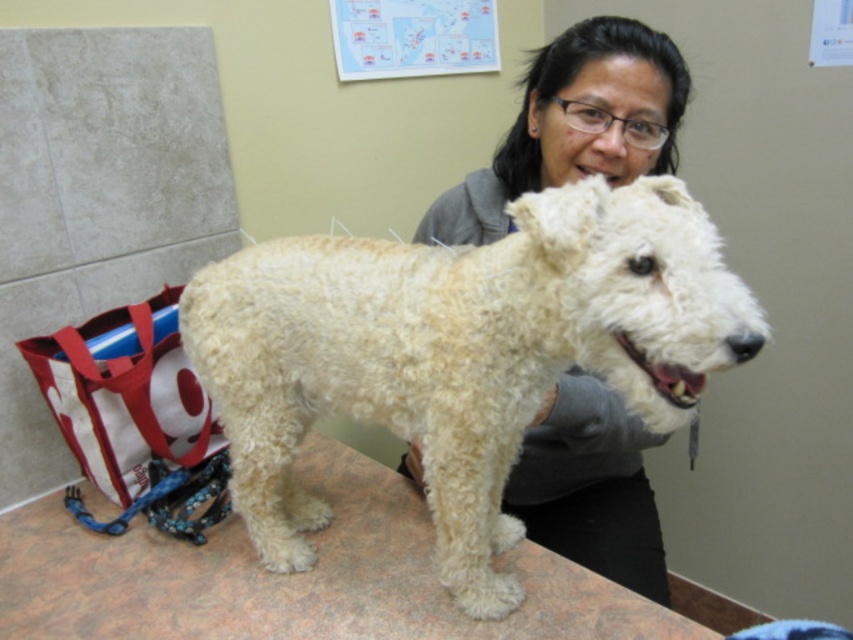
Question: Considering the real-world distances, which object is farthest from the smooth brown table at center?

Choices:
 (A) smooth gray hoodie at center
 (B) white fluffy dog at center

Answer: (A)

Question: Which point is closer to the camera taking this photo?

Choices:
 (A) (640, 554)
 (B) (440, 497)

Answer: (B)

Question: Is white fluffy dog at center positioned at the back of smooth brown table at center?

Choices:
 (A) yes
 (B) no

Answer: (B)

Question: Is white fluffy dog at center in front of smooth gray hoodie at center?

Choices:
 (A) yes
 (B) no

Answer: (A)

Question: Which point is closer to the camera?

Choices:
 (A) (660, 365)
 (B) (659, 52)

Answer: (A)

Question: Is white fluffy dog at center below smooth gray hoodie at center?

Choices:
 (A) yes
 (B) no

Answer: (B)